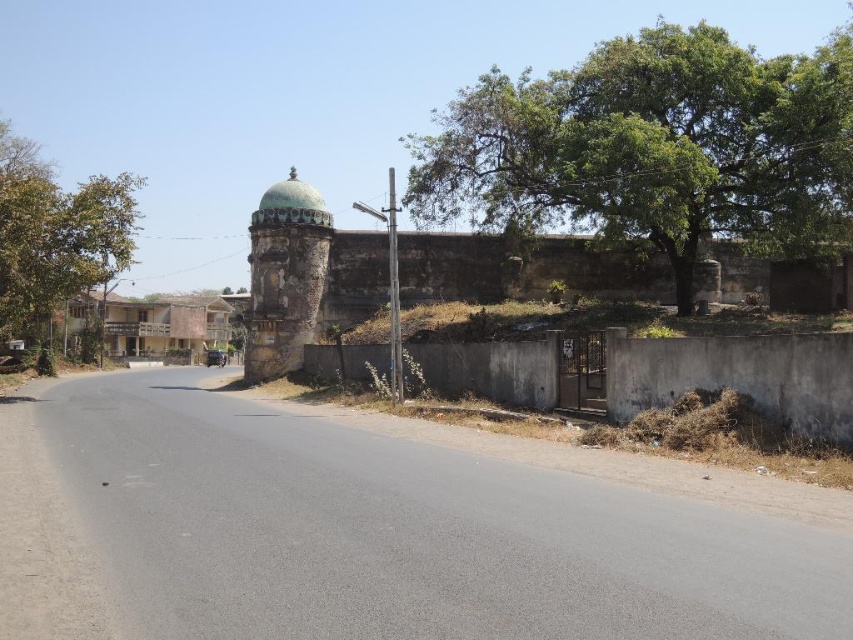
Between rusty stone fort at center and green leafy tree at left, which one appears on the left side from the viewer's perspective?

green leafy tree at left is more to the left.

Which of these two, rusty stone fort at center or green leafy tree at left, stands shorter?

Standing shorter between the two is rusty stone fort at center.

This screenshot has height=640, width=853. I want to click on rusty stone fort at center, so (305, 276).

The width and height of the screenshot is (853, 640). Identify the location of rusty stone fort at center. (305, 276).

Is point (663, 29) positioned before point (265, 364)?

Yes, it is in front of point (265, 364).

Can you confirm if green leafy tree at upper right is positioned above rusty stone fort at center?

Correct, green leafy tree at upper right is located above rusty stone fort at center.

Identify the location of green leafy tree at upper right. (653, 147).

Who is positioned more to the right, green leafy tree at upper right or green leafy tree at left?

green leafy tree at upper right is more to the right.

Does green leafy tree at upper right appear under green leafy tree at left?

Incorrect, green leafy tree at upper right is not positioned below green leafy tree at left.

The width and height of the screenshot is (853, 640). What do you see at coordinates (653, 147) in the screenshot?
I see `green leafy tree at upper right` at bounding box center [653, 147].

Where is `green leafy tree at upper right`? This screenshot has height=640, width=853. green leafy tree at upper right is located at coordinates (653, 147).